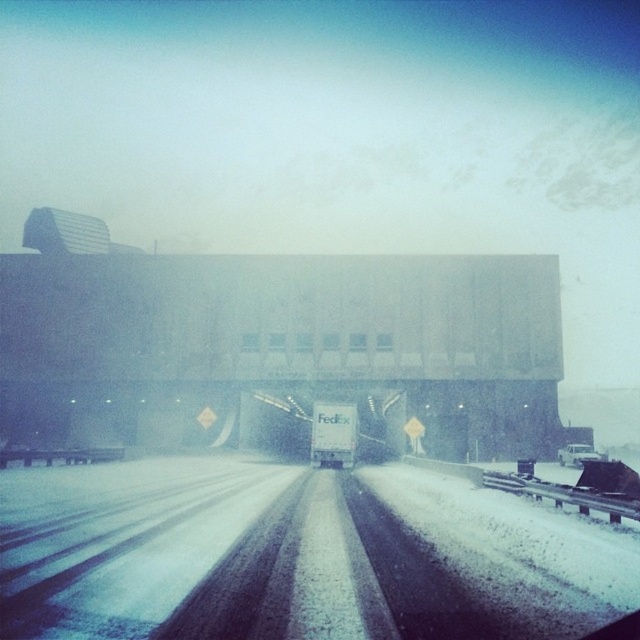
You are a delivery driver navigating a snowy highway. Your GPS shows a point at coordinates (298, 556) which is the white snow covered highway at center. Is this point on the highway?

Yes, the point at (298, 556) is on the white snow covered highway at center as indicated by the description.